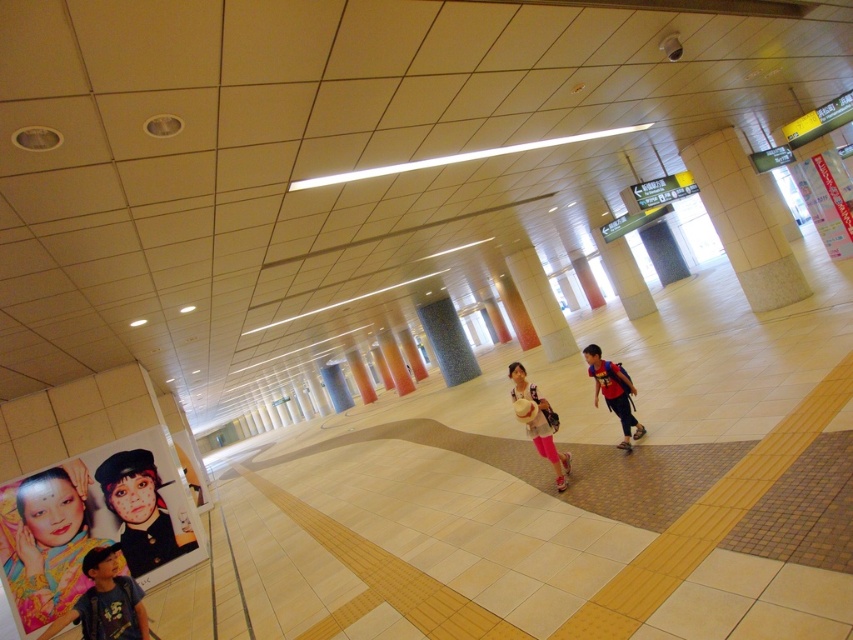
Can you confirm if colorful paper poster at lower left is shorter than matte red backpack at center?

Incorrect, colorful paper poster at lower left's height does not fall short of matte red backpack at center's.

Who is more forward, (45, 577) or (619, 372)?

Point (619, 372)

Between point (164, 492) and point (628, 392), which one is positioned behind?

The point (164, 492) is behind.

Find the location of `colorful paper poster at lower left`. colorful paper poster at lower left is located at coordinates (94, 524).

Is matte black hat at lower left positioned in front of dark blue t-shirt at lower left?

No, matte black hat at lower left is further to the viewer.

Is point (131, 496) behind point (102, 593)?

Yes, point (131, 496) is behind point (102, 593).

The height and width of the screenshot is (640, 853). Describe the element at coordinates (143, 512) in the screenshot. I see `matte black hat at lower left` at that location.

Identify the location of matte black hat at lower left. (143, 512).

Between matte black hat at lower left and matte red backpack at center, which one has more height?

matte black hat at lower left

Where is `matte black hat at lower left`? This screenshot has height=640, width=853. matte black hat at lower left is located at coordinates (143, 512).

The width and height of the screenshot is (853, 640). Describe the element at coordinates (143, 512) in the screenshot. I see `matte black hat at lower left` at that location.

In order to click on matte black hat at lower left in this screenshot , I will do `click(143, 512)`.